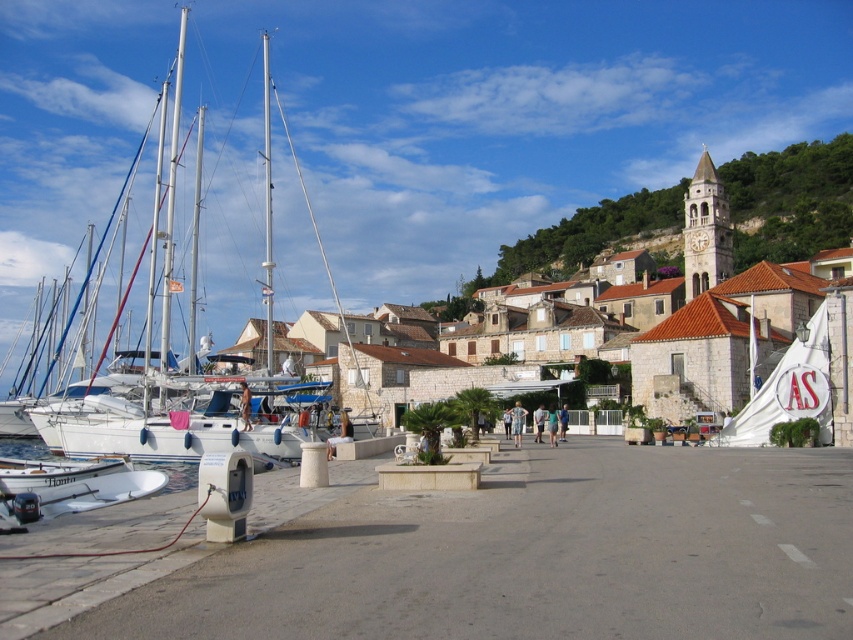
You are standing at the waterfront in the coastal town and want to take a photo of the stone clock tower at upper right. Since you can only see objects within your field of view, which is limited to the area below the point represented by point (792, 196), can you see the stone clock tower at upper right in your current position?

The stone clock tower at upper right is represented by point (792, 196). Since your field of view is limited to the area below this point, you cannot see the stone clock tower at upper right as it is exactly at the boundary of your field of view.

You are a boat operator who needs to move the white glossy sailboat at left from its current position. Considering the narrow passage between the boats and the stone clock tower at upper right, can you safely maneuver the boat without hitting the tower?

The white glossy sailboat at left might be wider than the stone clock tower at upper right, so there is a risk of collision. You should check the exact dimensions before attempting to move it to ensure safe passage.

You are a tourist in the coastal town and want to take a photo of the white glossy sailboat at left and the stone clock tower at upper right. Which object should you focus on first if you want both in the frame without moving your camera?

The white glossy sailboat at left is positioned on the left side of the stone clock tower at upper right, so focusing on the sailboat first will allow both objects to be captured in the frame without needing to reposition the camera.